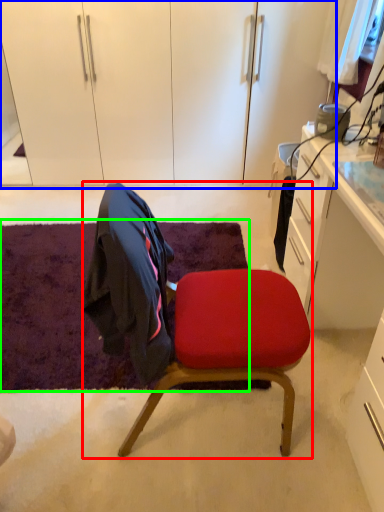
Question: Based on their relative distances, which object is farther from chair (highlighted by a red box)? Choose from dresser (highlighted by a blue box) and mat (highlighted by a green box).

Choices:
 (A) dresser
 (B) mat

Answer: (A)